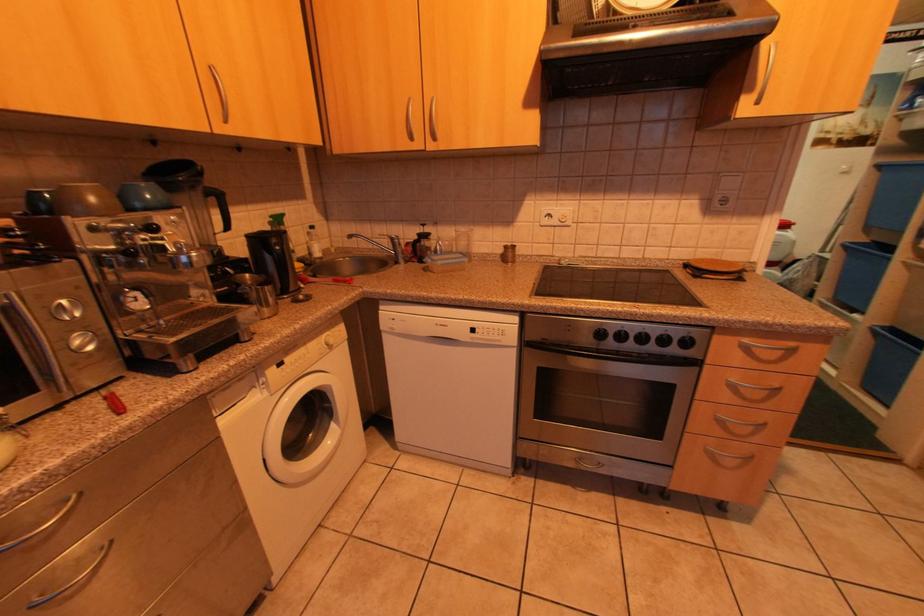
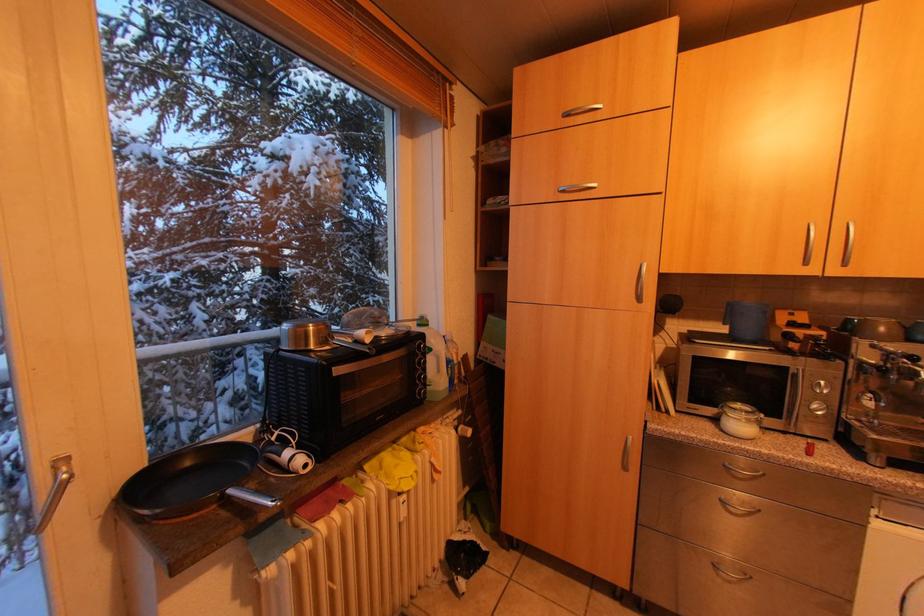
Question: The camera is either moving clockwise (left) or counter-clockwise (right) around the object. The first image is from the beginning of the video and the second image is from the end. Is the camera moving left or right when shooting the video?

Choices:
 (A) Left
 (B) Right

Answer: (B)